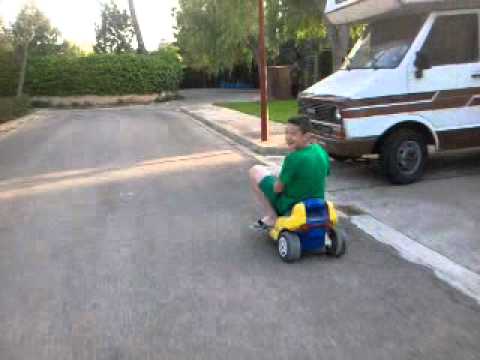
Where is `yellow and blue small toy bike`? yellow and blue small toy bike is located at coordinates (296, 217), (312, 217).